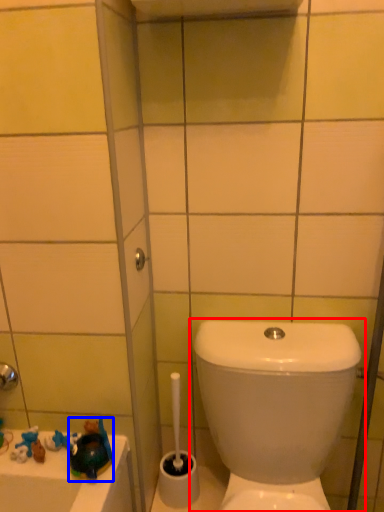
Question: Which object appears closest to the camera in this image, toilet (highlighted by a red box) or toy (highlighted by a blue box)?

Choices:
 (A) toilet
 (B) toy

Answer: (A)